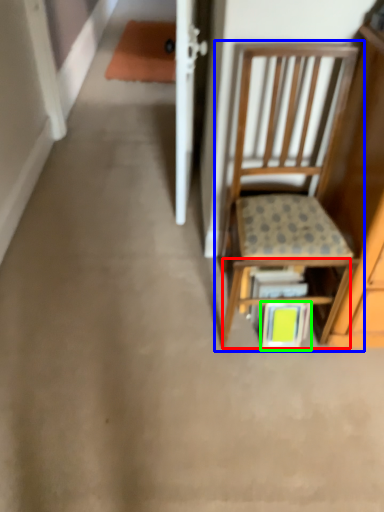
Question: Which object is the farthest from shelf (highlighted by a red box)? Choose among these: chair (highlighted by a blue box) or book (highlighted by a green box).

Choices:
 (A) chair
 (B) book

Answer: (A)